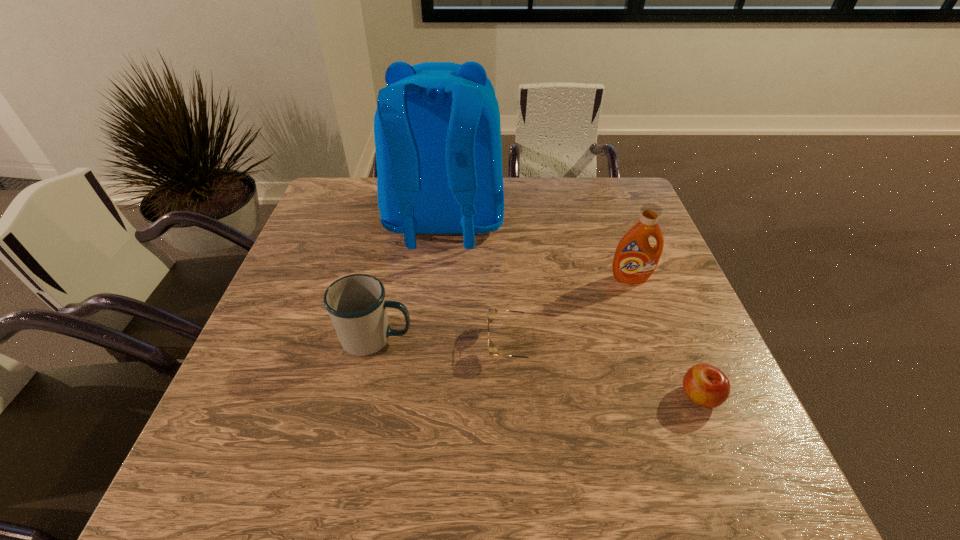
This screenshot has width=960, height=540. In order to click on blank area in the image that satisfies the following two spatial constraints: 1. on the back of the fourth tallest object; 2. on the left side of the farthest object in this screenshot , I will do coord(427,396).

What are the coordinates of `vacant space that satisfies the following two spatial constraints: 1. on the front-facing side of the apple; 2. on the right side of the detergent` in the screenshot? It's located at (674, 396).

The image size is (960, 540). What are the coordinates of `free space in the image that satisfies the following two spatial constraints: 1. on the back of the tallest object; 2. on the left side of the nearest object` in the screenshot? It's located at (427, 396).

Image resolution: width=960 pixels, height=540 pixels. Identify the location of free space that satisfies the following two spatial constraints: 1. on the front lenses of the sunglasses; 2. on the back side of the fourth tallest object. (516, 396).